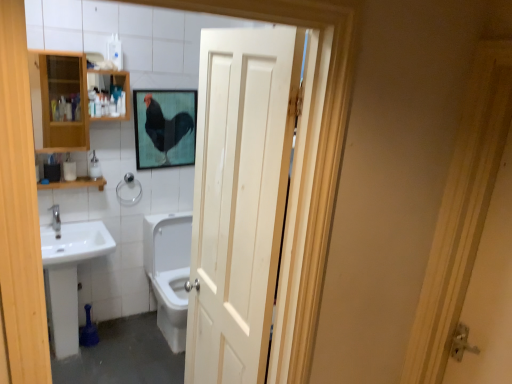
Where is `vacant space situated above wooden shelf at left (from a real-world perspective)`? vacant space situated above wooden shelf at left (from a real-world perspective) is located at coordinates (64, 176).